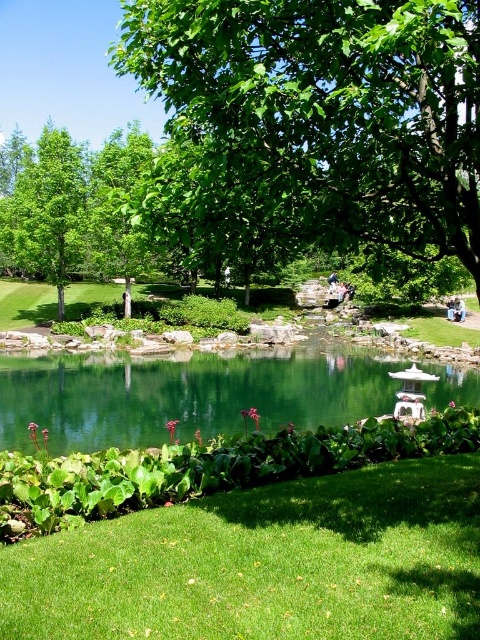
Question: Which point is closer to the camera taking this photo?

Choices:
 (A) (431, 109)
 (B) (212, 636)

Answer: (B)

Question: Is green leafy tree at left behind green leafy tree at upper left?

Choices:
 (A) yes
 (B) no

Answer: (A)

Question: Which of the following is the closest to the observer?

Choices:
 (A) green grass at lower center
 (B) green leafy tree at upper left
 (C) green glossy lake at center

Answer: (A)

Question: Can you confirm if green glossy lake at center is thinner than green leafy tree at upper left?

Choices:
 (A) yes
 (B) no

Answer: (B)

Question: Is green leafy tree at center thinner than green glossy lake at center?

Choices:
 (A) yes
 (B) no

Answer: (A)

Question: Among these objects, which one is farthest from the camera?

Choices:
 (A) green leafy tree at left
 (B) green grass at lower center
 (C) green leafy tree at center

Answer: (A)